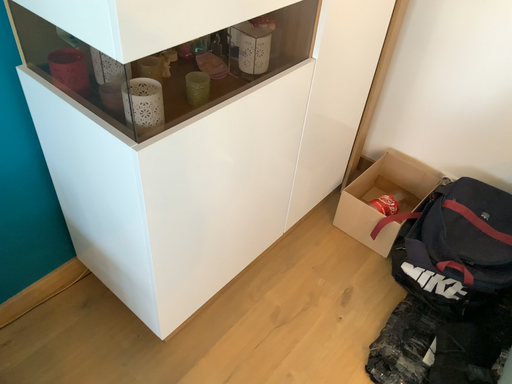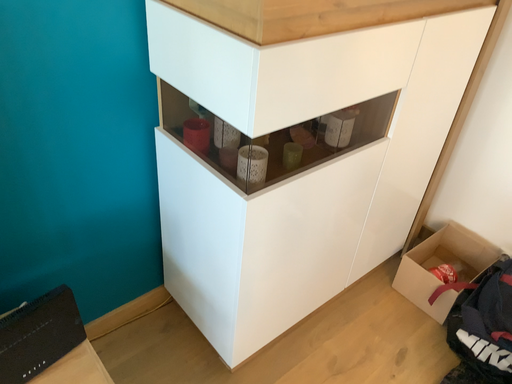
Question: How did the camera likely rotate when shooting the video?

Choices:
 (A) rotated left
 (B) rotated right

Answer: (A)